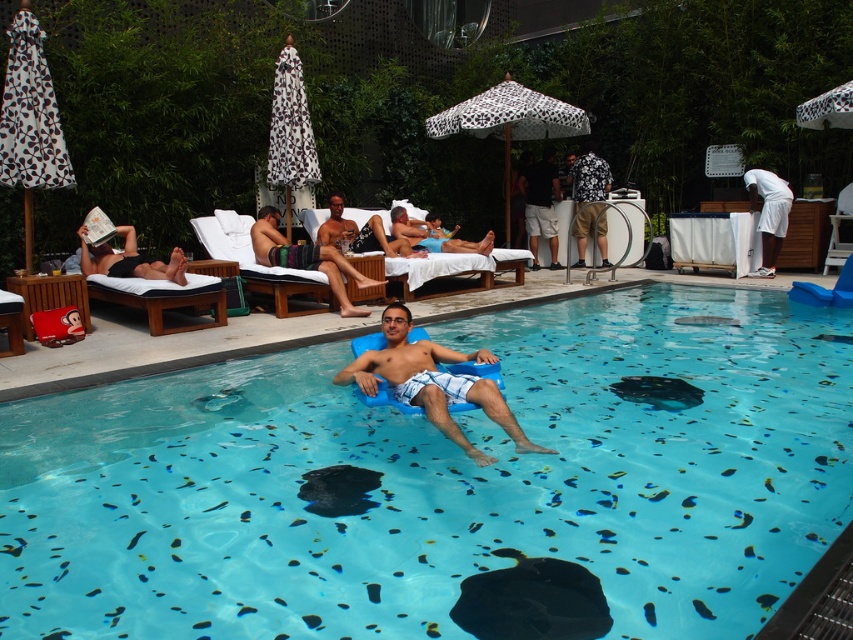
Question: Is printed fabric umbrella at upper center closer to camera compared to smooth tan skin at center?

Choices:
 (A) yes
 (B) no

Answer: (B)

Question: Among these objects, which one is nearest to the camera?

Choices:
 (A) printed fabric umbrella at upper center
 (B) floral shirt at center

Answer: (A)

Question: Does black and white printed umbrella at upper left come in front of white printed fabric umbrella at upper center?

Choices:
 (A) yes
 (B) no

Answer: (A)

Question: Does black rubber stingray at center have a lesser width compared to white printed fabric umbrella at upper center?

Choices:
 (A) no
 (B) yes

Answer: (B)

Question: Which of the following is the closest to the observer?

Choices:
 (A) smooth tan skin at center
 (B) printed fabric umbrella at upper center
 (C) striped towel at center
 (D) white printed fabric umbrella at upper center

Answer: (C)

Question: Which point is farther to the camera?

Choices:
 (A) (750, 193)
 (B) (506, 592)
 (C) (271, 173)
 (D) (306, 252)

Answer: (A)